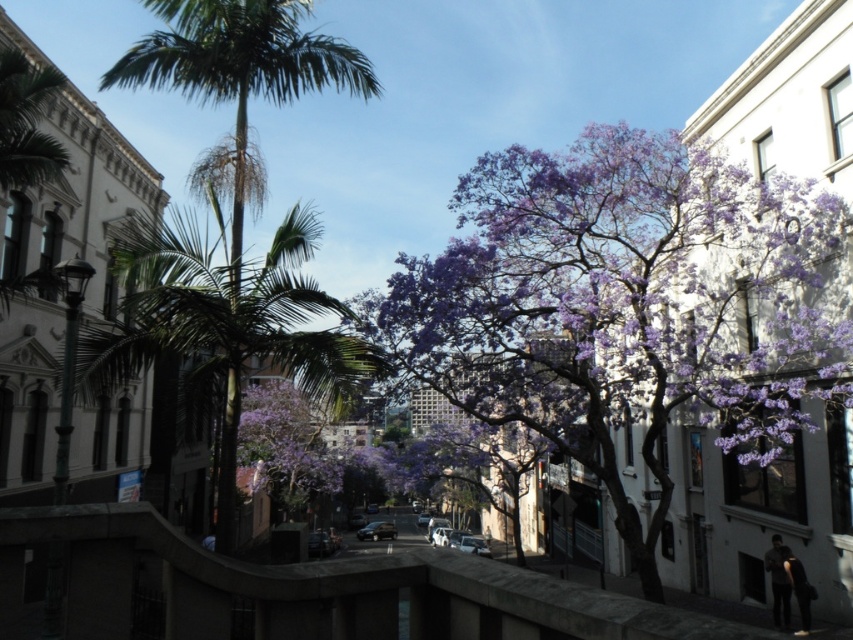
You are a pedestrian standing on the street in the image. You want to walk from the green leafy palm tree at left to the purple bloom at center. Which direction should you walk?

You should walk to the right to reach the purple bloom at center from the green leafy palm tree at left since the purple bloom at center is located to the right of the green leafy palm tree at left.

Based on the photo, you are a city planner assessing the street layout. Considering the purple bloom at center and the green leafy palm tree at left, which one is taller?

The green leafy palm tree at left is taller than the purple bloom at center.